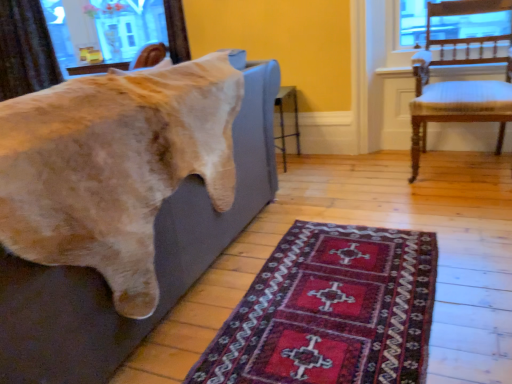
Question: In terms of width, does wooden chair with white cushioning at right look wider or thinner when compared to brown textured curtain at upper left?

Choices:
 (A) thin
 (B) wide

Answer: (B)

Question: From a real-world perspective, relative to brown textured curtain at upper left, is wooden chair with white cushioning at right vertically above or below?

Choices:
 (A) above
 (B) below

Answer: (B)

Question: Which object is positioned closest to the soft gray couch at left?

Choices:
 (A) dark red woven rug at lower center
 (B) wooden chair with white cushioning at right
 (C) brown textured curtain at upper left

Answer: (A)

Question: Based on their relative distances, which object is farther from the soft gray couch at left?

Choices:
 (A) dark red woven rug at lower center
 (B) brown textured curtain at upper left
 (C) wooden chair with white cushioning at right

Answer: (B)